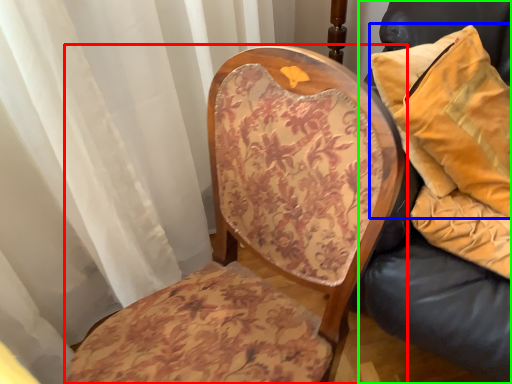
Question: Estimate the real-world distances between objects in this image. Which object is farther from chair (highlighted by a red box), pillow (highlighted by a blue box) or furniture (highlighted by a green box)?

Choices:
 (A) pillow
 (B) furniture

Answer: (A)